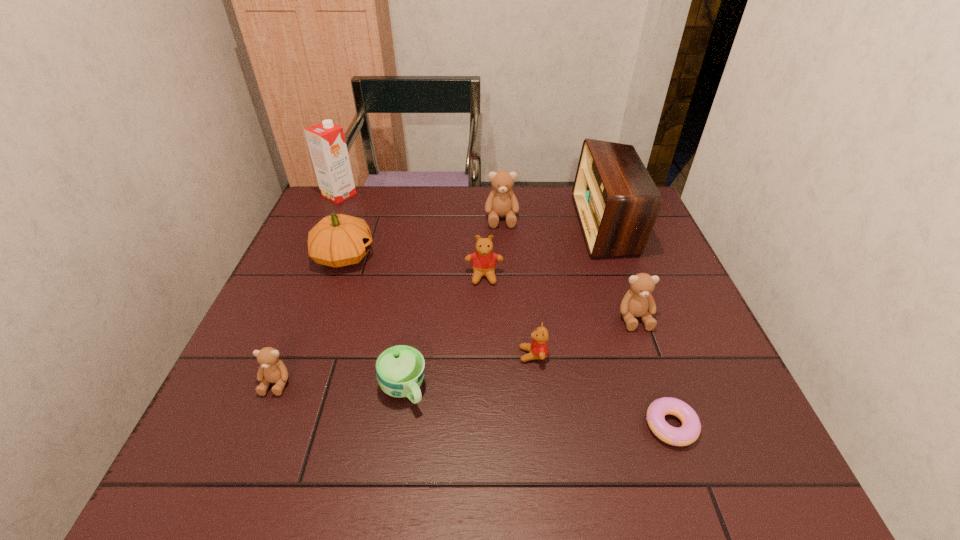
Find the location of a particular element. The height and width of the screenshot is (540, 960). free space between the leftmost teddy bear and the second tallest object is located at coordinates (441, 303).

The width and height of the screenshot is (960, 540). In order to click on free point between the cup and the tallest teddy bear in this screenshot , I will do [x=452, y=303].

Locate an element on the screen. vacant region between the rightmost teddy bear and the second shortest object is located at coordinates (519, 353).

The image size is (960, 540). I want to click on empty location between the tallest object and the smallest brown teddy bear, so click(x=307, y=289).

Identify the location of free space between the second nearest teddy bear and the radio receiver. Image resolution: width=960 pixels, height=540 pixels. (569, 289).

Locate an element on the screen. Image resolution: width=960 pixels, height=540 pixels. free space between the ninth tallest object and the bigger red teddy bear is located at coordinates (444, 333).

Locate an element on the screen. The image size is (960, 540). object that stands as the closest to the third farthest teddy bear is located at coordinates (617, 202).

Find the location of `the closest object to the nearer red teddy bear`. the closest object to the nearer red teddy bear is located at coordinates (638, 301).

Identify which teddy bear is the nearest to the third farthest teddy bear. Please provide its 2D coordinates. Your answer should be formatted as a tuple, i.e. [(x, y)], where the tuple contains the x and y coordinates of a point satisfying the conditions above.

[(538, 348)]

This screenshot has height=540, width=960. Identify the location of the fourth closest teddy bear relative to the second brown teddy bear from right to left. (272, 370).